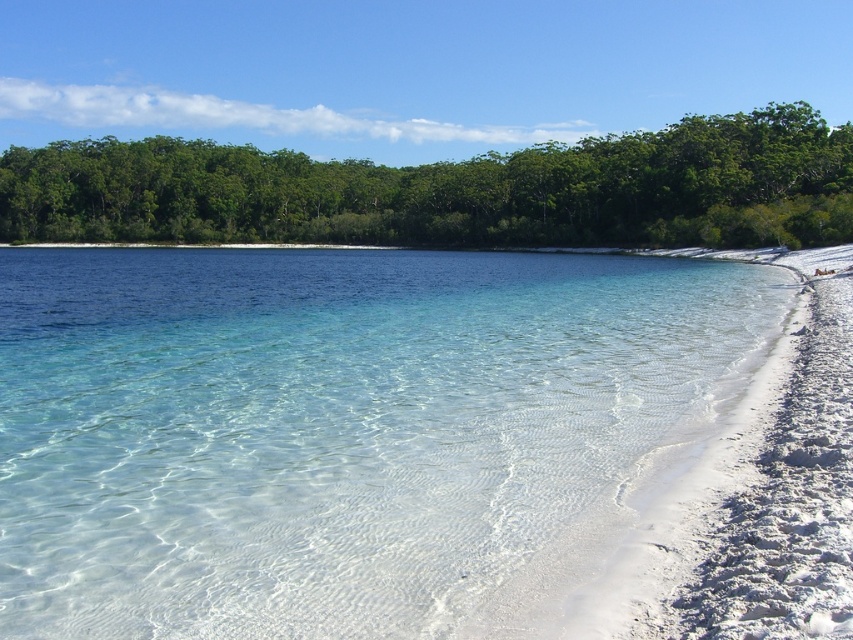
You are standing on the beach and want to take a photo of the point at coordinates (750, 292). If your camera can focus up to 40 meters away, will it be able to capture the point clearly?

The point at coordinates (750, 292) is 42.50 meters away from the camera, which exceeds the camera focus limit of 40 meters. Therefore, the camera will not be able to capture the point clearly.

You are standing on the beach and want to take a photo of the clear water at center and the green leafy trees at upper center. Which object will appear closer to the camera in the photo?

The clear water at center will appear closer to the camera in the photo because it is in front of the green leafy trees at upper center.

You are a beachgoer who wants to take a photo of the clear water at center and the green leafy trees at upper center. Which object is located to the right of the other?

The clear water at center is positioned on the right side of green leafy trees at upper center.